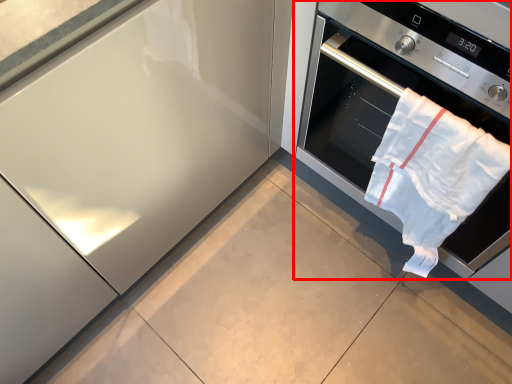
Question: From the image's perspective, where is home appliance (annotated by the red box) located in relation to beach towel in the image?

Choices:
 (A) below
 (B) above

Answer: (B)